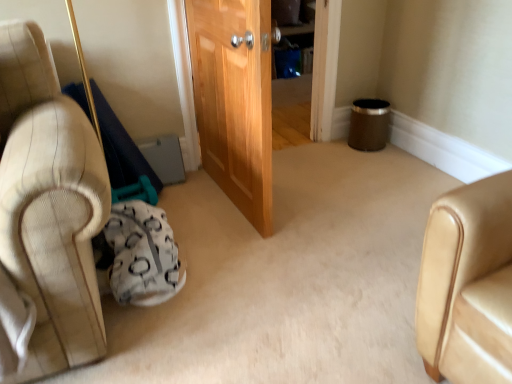
Question: From the image's perspective, is wooden door at center located beneath white textured bean bag at lower left?

Choices:
 (A) no
 (B) yes

Answer: (A)

Question: From a real-world perspective, is wooden door at center on top of white textured bean bag at lower left?

Choices:
 (A) no
 (B) yes

Answer: (B)

Question: Is there a large distance between wooden door at center and white textured bean bag at lower left?

Choices:
 (A) no
 (B) yes

Answer: (A)

Question: From a real-world perspective, is wooden door at center beneath white textured bean bag at lower left?

Choices:
 (A) no
 (B) yes

Answer: (A)

Question: Is wooden door at center to the left of white textured bean bag at lower left from the viewer's perspective?

Choices:
 (A) no
 (B) yes

Answer: (A)

Question: Is wooden door at center completely or partially outside of white textured bean bag at lower left?

Choices:
 (A) yes
 (B) no

Answer: (A)

Question: Is wooden door at center at the back of white textured bean bag at lower left?

Choices:
 (A) no
 (B) yes

Answer: (A)

Question: From the image's perspective, is white textured bean bag at lower left beneath wooden door at center?

Choices:
 (A) yes
 (B) no

Answer: (A)

Question: Can wooden door at center be found inside white textured bean bag at lower left?

Choices:
 (A) no
 (B) yes

Answer: (A)

Question: Is white textured bean bag at lower left aimed at wooden door at center?

Choices:
 (A) yes
 (B) no

Answer: (B)

Question: From the image's perspective, is white textured bean bag at lower left on wooden door at center?

Choices:
 (A) yes
 (B) no

Answer: (B)

Question: Does white textured bean bag at lower left have a greater height compared to wooden door at center?

Choices:
 (A) no
 (B) yes

Answer: (A)

Question: From the image's perspective, relative to white textured bean bag at lower left, is wooden door at center above or below?

Choices:
 (A) above
 (B) below

Answer: (A)